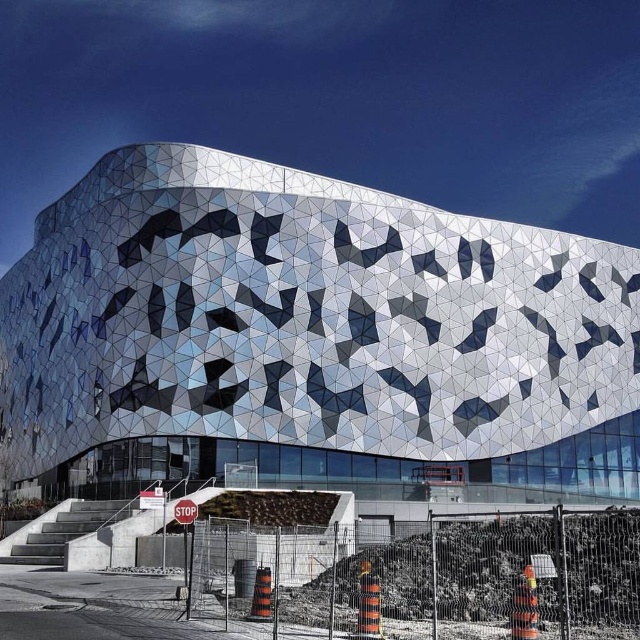
Locate an element on the screen. The height and width of the screenshot is (640, 640). metallic geometric facade at center is located at coordinates (310, 333).

Can you confirm if metallic geometric facade at center is wider than red plastic stop sign at center?

Correct, the width of metallic geometric facade at center exceeds that of red plastic stop sign at center.

Between point (189, 376) and point (179, 504), which one is positioned behind?

The point (189, 376) is behind.

Locate an element on the screen. metallic geometric facade at center is located at coordinates (310, 333).

Which of these two, metallic geometric facade at center or orange traffic cone at lower center, stands shorter?

orange traffic cone at lower center

Between point (308, 323) and point (333, 538), which one is positioned behind?

Positioned behind is point (308, 323).

Does point (605, 256) lie behind point (51, 536)?

Yes, it is behind point (51, 536).

Locate an element on the screen. metallic geometric facade at center is located at coordinates (310, 333).

Looking at this image, is orange traffic cone at lower center closer to camera compared to red plastic stop sign at center?

Yes, orange traffic cone at lower center is in front of red plastic stop sign at center.

Which is more to the right, orange traffic cone at lower center or red plastic stop sign at center?

Positioned to the right is orange traffic cone at lower center.

What do you see at coordinates (346, 577) in the screenshot? The image size is (640, 640). I see `orange traffic cone at lower center` at bounding box center [346, 577].

This screenshot has height=640, width=640. Identify the location of orange traffic cone at lower center. (x=346, y=577).